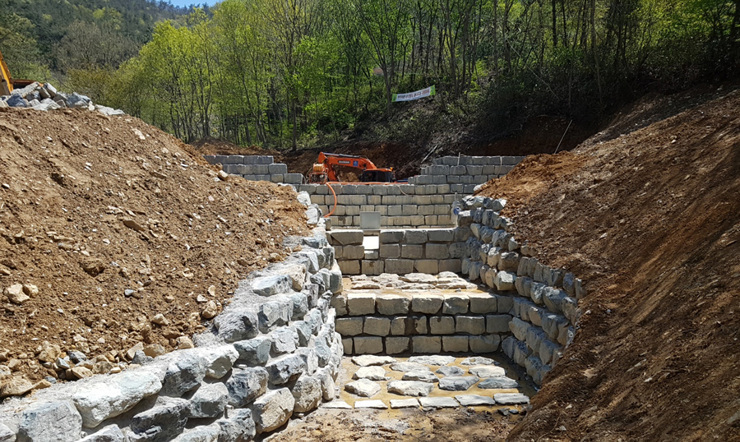
You are a GUI agent. You are given a task and a screenshot of the screen. Output one action in this format:
    pyautogui.click(x=<x>, y=<y>)
    Task: Click on the brick wall
    This screenshot has width=740, height=442.
    Given the screenshot: What is the action you would take?
    pyautogui.click(x=416, y=201)